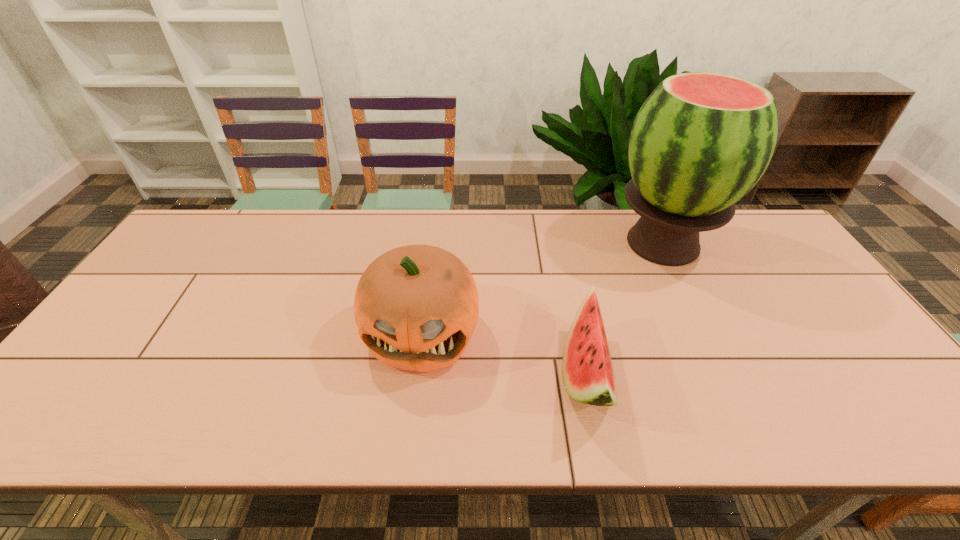
Image resolution: width=960 pixels, height=540 pixels. What are the coordinates of `free space between the shorter watermelon and the second shortest object` in the screenshot? It's located at (504, 353).

Identify the location of unoccupied area between the farther watermelon and the left watermelon. The height and width of the screenshot is (540, 960). (625, 308).

Where is `empty space that is in between the nearer watermelon and the right watermelon`? empty space that is in between the nearer watermelon and the right watermelon is located at coordinates (625, 308).

At what (x,y) coordinates should I click in order to perform the action: click on unoccupied area between the shorter watermelon and the right watermelon. Please return your answer as a coordinate pair (x, y). Looking at the image, I should click on (625, 308).

Identify the location of free spot between the second tallest object and the farthest object. This screenshot has width=960, height=540. (542, 288).

You are a GUI agent. You are given a task and a screenshot of the screen. Output one action in this format:
    pyautogui.click(x=<x>, y=<y>)
    Task: Click on the vacant point located between the second object from right to left and the second shortest object
    The image size is (960, 540).
    Given the screenshot: What is the action you would take?
    pyautogui.click(x=504, y=353)

Locate an element on the screen. empty location between the second shortest object and the rightmost object is located at coordinates (542, 288).

Locate an element on the screen. This screenshot has height=540, width=960. vacant area that lies between the tallest object and the pumpkin is located at coordinates (542, 288).

Image resolution: width=960 pixels, height=540 pixels. I want to click on blank region between the rightmost object and the leftmost object, so click(x=542, y=288).

Point out which object is positioned as the second nearest to the farthest object. Please provide its 2D coordinates. Your answer should be formatted as a tuple, i.e. [(x, y)], where the tuple contains the x and y coordinates of a point satisfying the conditions above.

[(416, 307)]